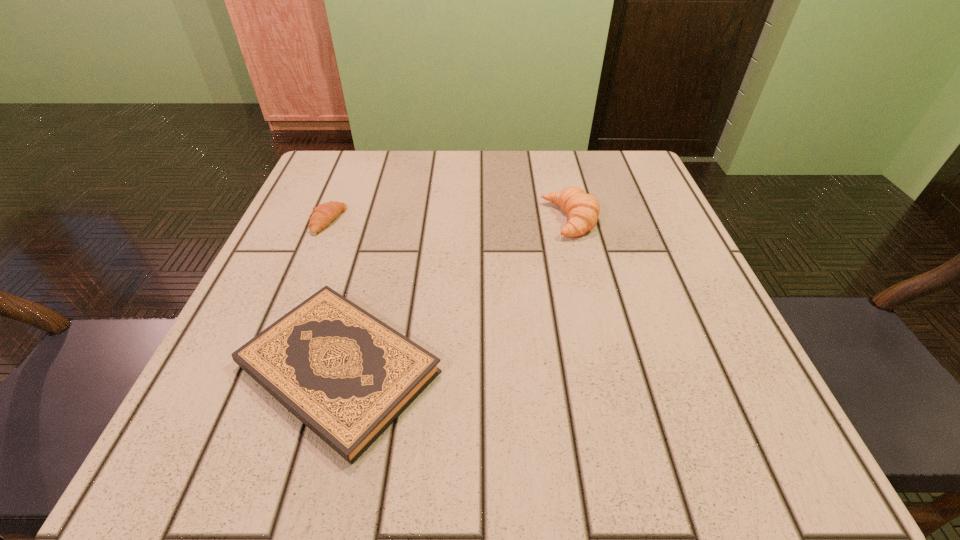
The image size is (960, 540). In order to click on vacant area between the tallest object and the shorter crescent roll in this screenshot , I will do `click(449, 220)`.

At what (x,y) coordinates should I click in order to perform the action: click on unoccupied area between the tallest object and the hardback book. Please return your answer as a coordinate pair (x, y). This screenshot has width=960, height=540. Looking at the image, I should click on (454, 294).

Image resolution: width=960 pixels, height=540 pixels. I want to click on free space between the taller crescent roll and the left crescent roll, so click(x=449, y=220).

Identify the location of free space between the rightmost object and the left crescent roll. (449, 220).

This screenshot has height=540, width=960. I want to click on free space between the hardback book and the right crescent roll, so click(454, 294).

Find the location of `vacant area between the tallest object and the shorter crescent roll`. vacant area between the tallest object and the shorter crescent roll is located at coordinates pyautogui.click(x=449, y=220).

You are a GUI agent. You are given a task and a screenshot of the screen. Output one action in this format:
    pyautogui.click(x=<x>, y=<y>)
    Task: Click on the vacant area between the tallest object and the hardback book
    Image resolution: width=960 pixels, height=540 pixels.
    Given the screenshot: What is the action you would take?
    pyautogui.click(x=454, y=294)

Choose which object is the second nearest neighbor to the shorter crescent roll. Please provide its 2D coordinates. Your answer should be formatted as a tuple, i.e. [(x, y)], where the tuple contains the x and y coordinates of a point satisfying the conditions above.

[(583, 209)]

Locate an element on the screen. The height and width of the screenshot is (540, 960). the second closest object to the shorter crescent roll is located at coordinates (583, 209).

Where is `blank space that satisfies the following two spatial constraints: 1. on the back side of the rightmost object; 2. on the left side of the shorter crescent roll`? blank space that satisfies the following two spatial constraints: 1. on the back side of the rightmost object; 2. on the left side of the shorter crescent roll is located at coordinates (328, 220).